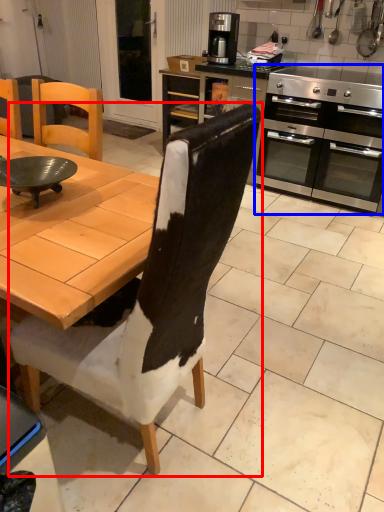
Question: Which point is closer to the camera, chair (highlighted by a red box) or kitchen appliance (highlighted by a blue box)?

Choices:
 (A) chair
 (B) kitchen appliance

Answer: (A)